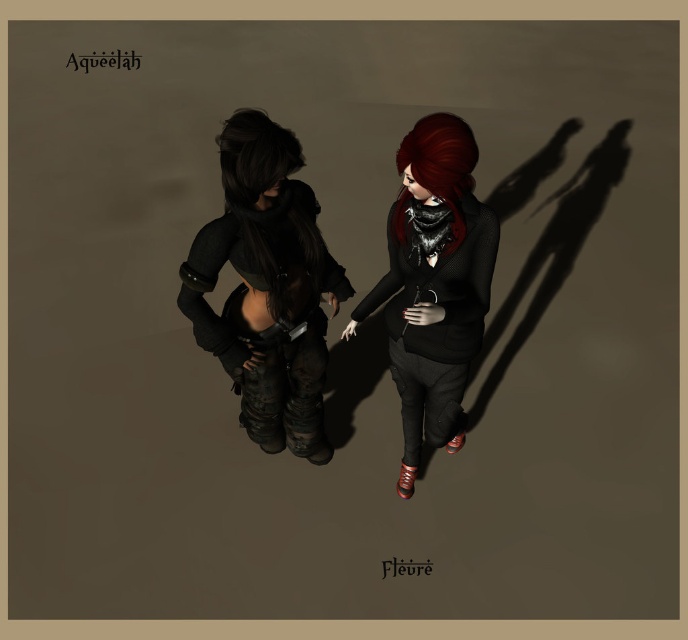
Who is positioned more to the right, matte black jacket at center or shiny black hair at center?

Positioned to the right is shiny black hair at center.

Which is in front, point (305, 372) or point (233, 122)?

Point (233, 122)

Describe the element at coordinates (266, 288) in the screenshot. I see `matte black jacket at center` at that location.

I want to click on matte black jacket at center, so click(x=266, y=288).

Who is positioned more to the right, matte black jacket at center or matte black sweater at center?

Positioned to the right is matte black sweater at center.

Can you confirm if matte black jacket at center is smaller than matte black sweater at center?

Yes.

Describe the element at coordinates (266, 288) in the screenshot. I see `matte black jacket at center` at that location.

Where is `matte black jacket at center`? Image resolution: width=688 pixels, height=640 pixels. matte black jacket at center is located at coordinates (266, 288).

Is matte black jacket at center taller than shiny red hair at center?

Correct, matte black jacket at center is much taller as shiny red hair at center.

Does point (321, 413) come closer to viewer compared to point (438, 138)?

That is False.

Is point (299, 385) positioned behind point (429, 124)?

Yes, it is behind point (429, 124).

Where is `matte black jacket at center`? matte black jacket at center is located at coordinates (266, 288).